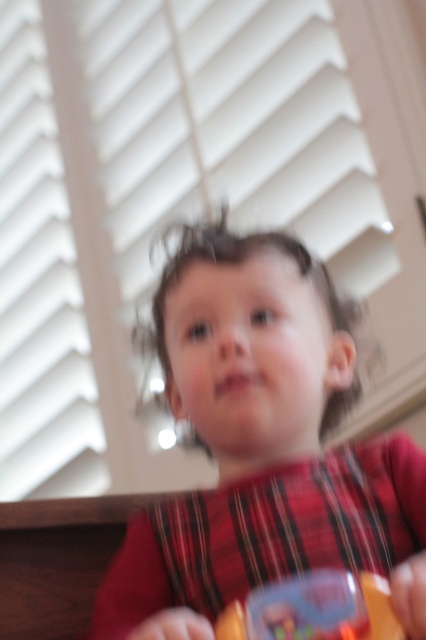
Consider the image. You are a photographer trying to capture a clear shot of the translucent plastic toy at lower center. The matte red shirt at center is blocking the view. Can you adjust your angle to see the toy without moving the shirt?

The matte red shirt at center is positioned over the translucent plastic toy at lower center, so adjusting your angle might allow you to see the toy underneath without moving the shirt.

The scene shows a child holding an object indoors. There are white matte blinds at upper center and a matte red shirt at center. Which object is wider?

The white matte blinds at upper center are wider than the matte red shirt at center.

You are a photographer trying to focus on two points in the image of the child. The first point is at coordinate point [302,168] and the second is at point [331,612]. Which point should you focus on first if you want to capture the closest object to the camera?

Point [302,168] is further to the viewer than point [331,612], so you should focus on point [302,168] first as it is closer to the camera.